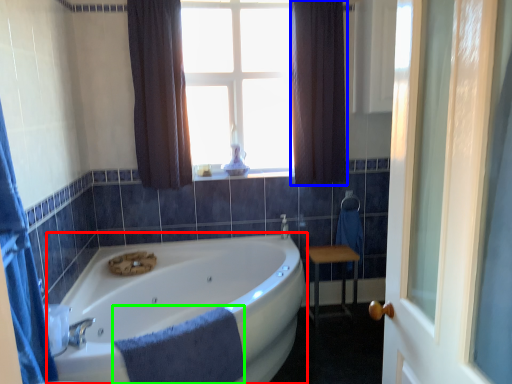
Question: Which object is positioned closest to bathtub (highlighted by a red box)? Select from curtain (highlighted by a blue box) and bath towel (highlighted by a green box).

Choices:
 (A) curtain
 (B) bath towel

Answer: (B)